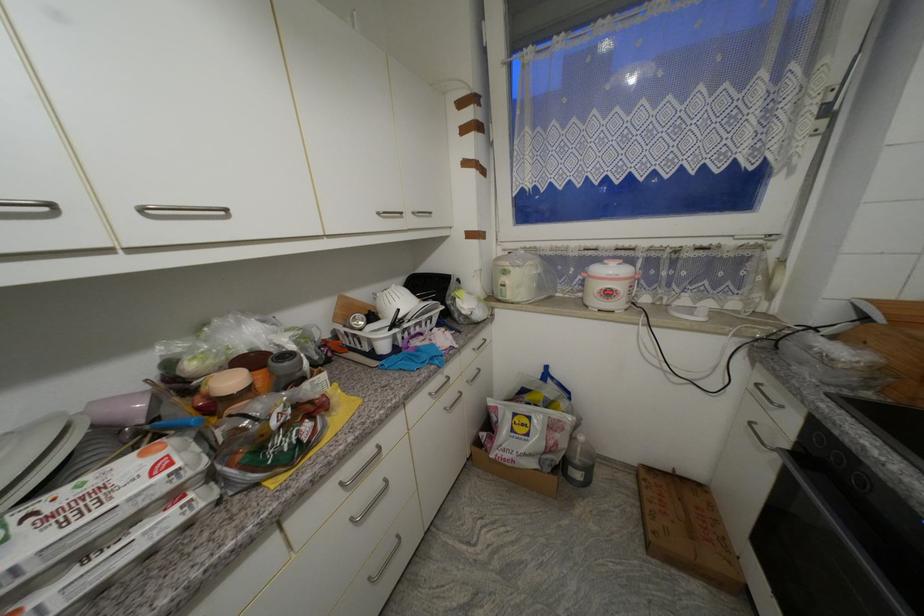
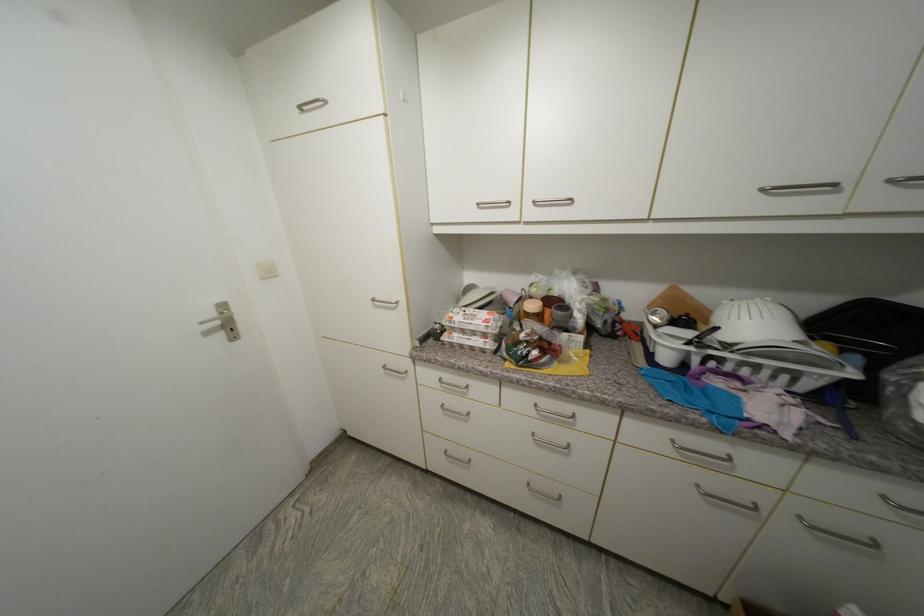
The point at (383, 215) is marked in the first image. Where is the corresponding point in the second image?

(768, 191)